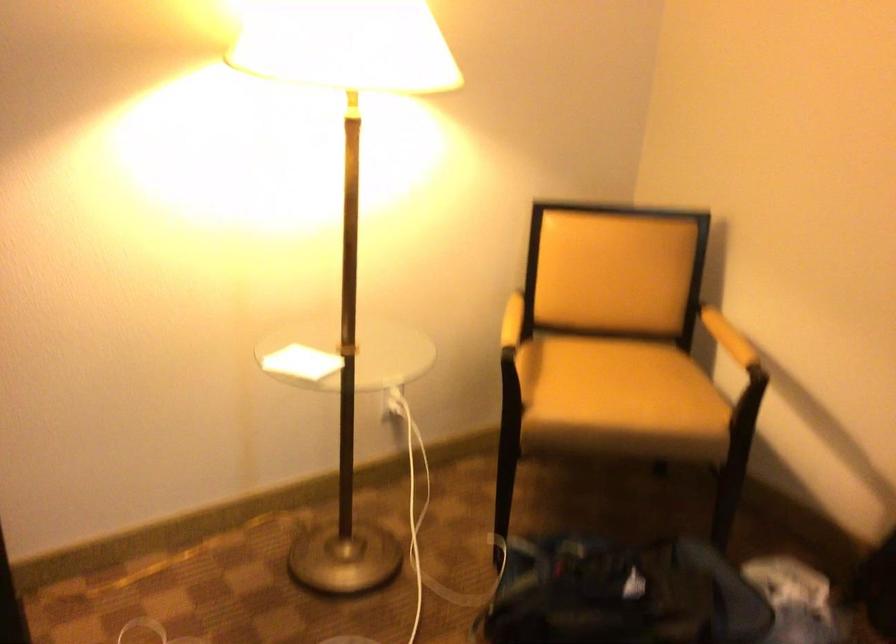
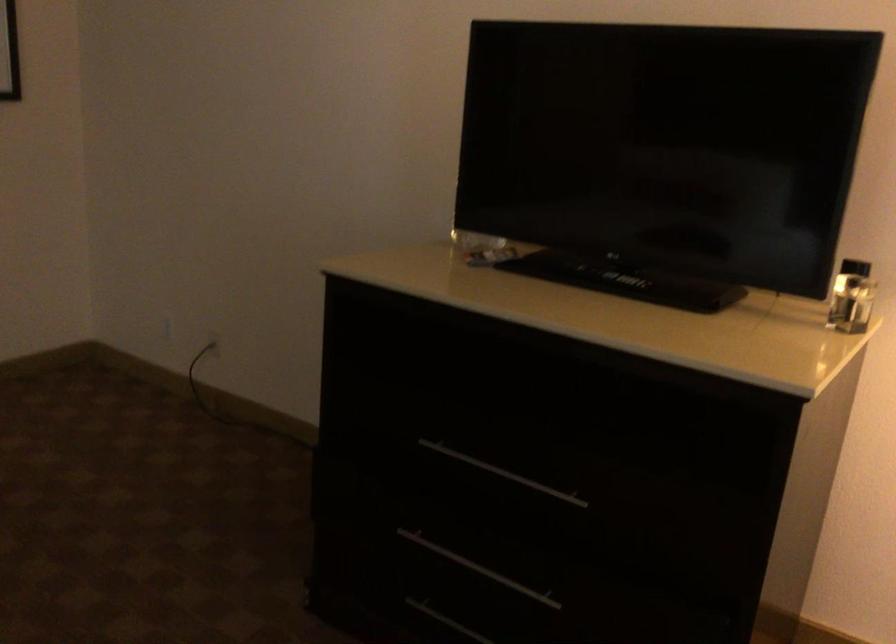
Question: Based on the continuous images, in which direction is the camera rotating? Reply with the corresponding letter.

Choices:
 (A) Left
 (B) Right
 (C) Up
 (D) Down

Answer: (A)